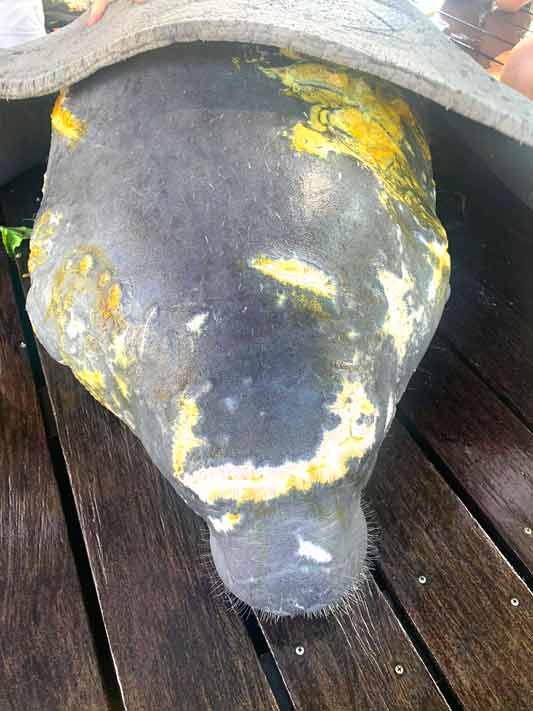
The image size is (533, 711). Identify the location of wood plank. (183, 673).